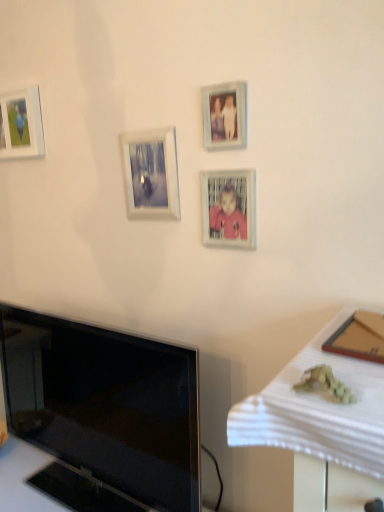
Question: Is matte white picture frame at upper left, the 1th picture frame positioned from the left, wider than black glossy tv at lower left?

Choices:
 (A) no
 (B) yes

Answer: (A)

Question: Considering the relative sizes of matte white picture frame at upper left, the 1th picture frame positioned from the left, and black glossy tv at lower left in the image provided, is matte white picture frame at upper left, the 1th picture frame positioned from the left, taller than black glossy tv at lower left?

Choices:
 (A) yes
 (B) no

Answer: (B)

Question: Is matte white picture frame at upper left, acting as the 4th picture frame starting from the front, closer to the viewer compared to black glossy tv at lower left?

Choices:
 (A) no
 (B) yes

Answer: (A)

Question: Is matte white picture frame at upper left, acting as the 4th picture frame starting from the front, turned away from black glossy tv at lower left?

Choices:
 (A) no
 (B) yes

Answer: (A)

Question: Can you confirm if matte white picture frame at upper left, the 1th picture frame positioned from the left, is smaller than black glossy tv at lower left?

Choices:
 (A) yes
 (B) no

Answer: (A)

Question: Considering the relative sizes of matte white picture frame at upper left, acting as the 4th picture frame starting from the front, and black glossy tv at lower left in the image provided, is matte white picture frame at upper left, acting as the 4th picture frame starting from the front, bigger than black glossy tv at lower left?

Choices:
 (A) no
 (B) yes

Answer: (A)

Question: From a real-world perspective, does black glossy tv at lower left stand above matte white picture frame at upper left, the 1th picture frame viewed from the back?

Choices:
 (A) no
 (B) yes

Answer: (A)

Question: Is black glossy tv at lower left aimed at matte white picture frame at upper left, the 1th picture frame positioned from the left?

Choices:
 (A) no
 (B) yes

Answer: (A)

Question: Considering the relative sizes of black glossy tv at lower left and matte white picture frame at upper left, the 1th picture frame viewed from the back, in the image provided, is black glossy tv at lower left wider than matte white picture frame at upper left, the 1th picture frame viewed from the back,?

Choices:
 (A) yes
 (B) no

Answer: (A)

Question: Is black glossy tv at lower left touching matte white picture frame at upper left, the 1th picture frame positioned from the left?

Choices:
 (A) yes
 (B) no

Answer: (B)

Question: Is black glossy tv at lower left taller than matte white picture frame at upper left, the 1th picture frame positioned from the left?

Choices:
 (A) yes
 (B) no

Answer: (A)

Question: From a real-world perspective, is black glossy tv at lower left beneath matte white picture frame at upper left, the 1th picture frame viewed from the back?

Choices:
 (A) no
 (B) yes

Answer: (B)

Question: From the image's perspective, does matte white picture frame at upper left, the 1th picture frame positioned from the left, appear lower than matte plastic picture frame at center, which is counted as the third picture frame, starting from the back?

Choices:
 (A) no
 (B) yes

Answer: (A)